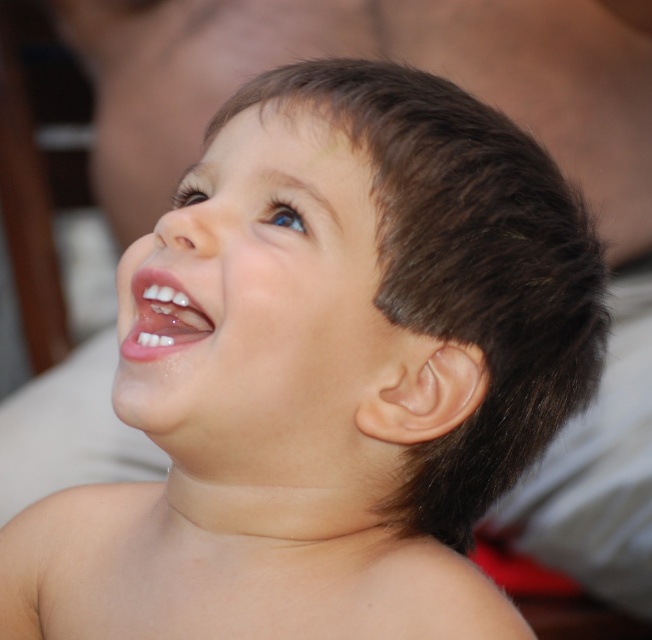
Question: Is smooth skin face at center thinner than white glossy teeth at center?

Choices:
 (A) yes
 (B) no

Answer: (B)

Question: From the image, what is the correct spatial relationship of smooth skin face at center in relation to white glossy teeth at center?

Choices:
 (A) below
 (B) above

Answer: (B)

Question: Which object is closer to the camera taking this photo?

Choices:
 (A) white glossy teeth at center
 (B) smooth skin face at center

Answer: (B)

Question: Does smooth skin face at center have a greater width compared to white glossy teeth at center?

Choices:
 (A) no
 (B) yes

Answer: (B)

Question: Which point is closer to the camera?

Choices:
 (A) (175, 324)
 (B) (357, 225)

Answer: (B)